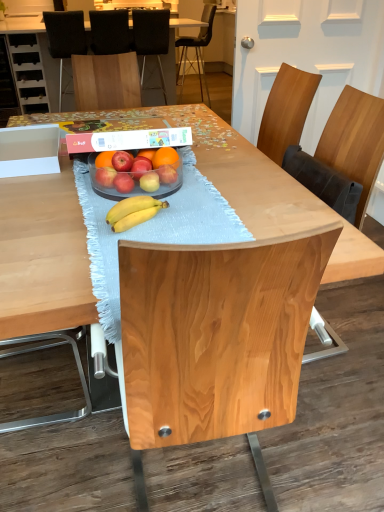
Question: Are black fabric chair at upper left, the fourth chair in the back-to-front sequence, and matte red apple at center, which is the 3th apple from left to right, making contact?

Choices:
 (A) no
 (B) yes

Answer: (A)

Question: Does black fabric chair at upper left, positioned as the 2th chair in front-to-back order, come in front of matte red apple at center, the fourth apple when ordered from right to left?

Choices:
 (A) no
 (B) yes

Answer: (A)

Question: Is black fabric chair at upper left, positioned as the 2th chair in front-to-back order, wider than matte red apple at center, which is the 3th apple from left to right?

Choices:
 (A) yes
 (B) no

Answer: (A)

Question: Does black fabric chair at upper left, the fourth chair in the back-to-front sequence, have a larger size compared to matte red apple at center, which is the 3th apple from left to right?

Choices:
 (A) yes
 (B) no

Answer: (A)

Question: Is black fabric chair at upper left, positioned as the 2th chair in front-to-back order, taller than matte red apple at center, the fourth apple when ordered from right to left?

Choices:
 (A) no
 (B) yes

Answer: (B)

Question: From a real-world perspective, is black fabric chair at upper left, positioned as the 2th chair in front-to-back order, under matte red apple at center, which is the 3th apple from left to right?

Choices:
 (A) yes
 (B) no

Answer: (A)

Question: Is smooth orange grapefruit at center taller than wooden table at center?

Choices:
 (A) no
 (B) yes

Answer: (A)

Question: Is smooth orange grapefruit at center wider than wooden table at center?

Choices:
 (A) no
 (B) yes

Answer: (A)

Question: From the image's perspective, would you say smooth orange grapefruit at center is shown under wooden table at center?

Choices:
 (A) no
 (B) yes

Answer: (B)

Question: Is smooth orange grapefruit at center touching wooden table at center?

Choices:
 (A) no
 (B) yes

Answer: (A)

Question: Is the depth of smooth orange grapefruit at center greater than that of wooden table at center?

Choices:
 (A) yes
 (B) no

Answer: (B)

Question: Would you say smooth orange grapefruit at center is outside wooden table at center?

Choices:
 (A) yes
 (B) no

Answer: (A)

Question: Is black leather chair at upper center, the fifth chair positioned from the front, positioned before matte red apple at center, which is the 3th apple from left to right?

Choices:
 (A) no
 (B) yes

Answer: (A)